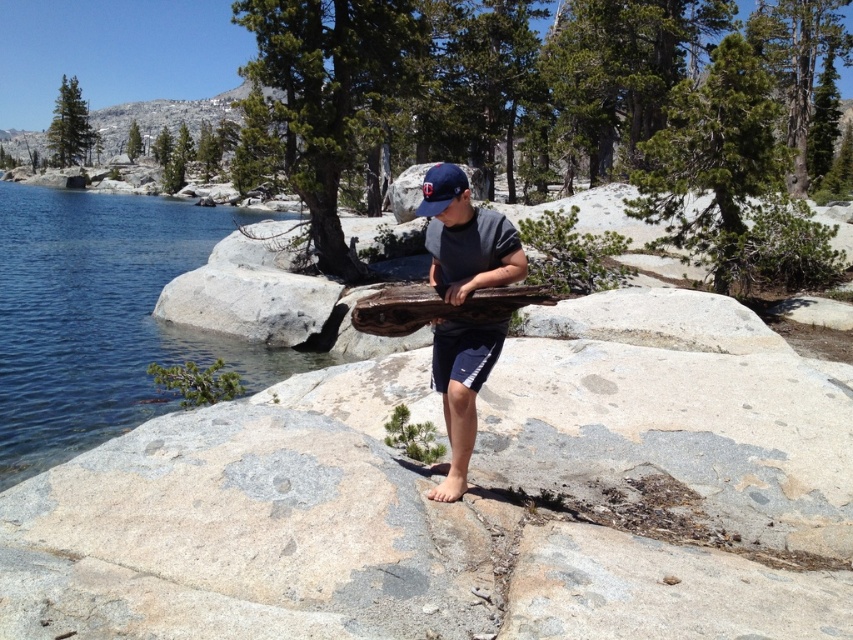
You are standing at the point marked by the coordinates (465, 237) in the image. Describe the object located exactly at this point and its color.

The object at point (465, 237) is matte brown wood at center, which has a matte brown color.

You are a photographer trying to capture the person holding the matte brown wood at center and the matte blue baseball cap at center in the same frame. Since you want both objects to appear balanced in size, which object should you move closer to the camera?

You should move the matte brown wood at center closer to the camera because it is smaller than the matte blue baseball cap at center, so bringing it nearer will make it appear larger in the photo and balance their sizes.

You are a photographer trying to capture the scene with a wide angle lens. You notice the clear blue water at left and the matte blue baseball cap at center. Which object should you focus on first if you want to ensure both are in frame but prioritize the larger one?

You should focus on the clear blue water at left first because it is larger in size than the matte blue baseball cap at center, so prioritizing it ensures it fits well within the frame.